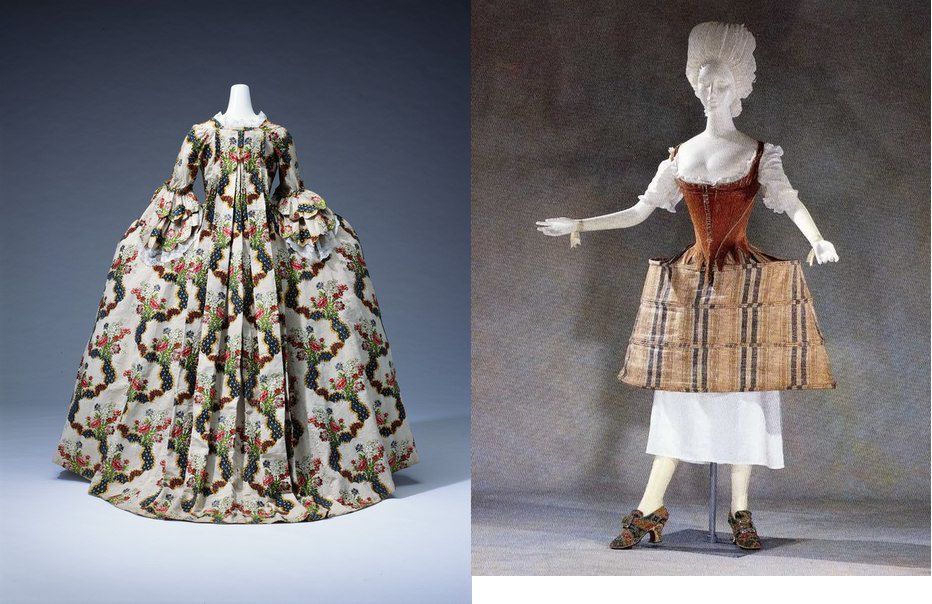
At what (x,y) coordinates should I click in order to perform the action: click on mannequin. Please return your answer as a coordinate pair (x, y). Image resolution: width=932 pixels, height=604 pixels. Looking at the image, I should click on (237, 107), (694, 144).